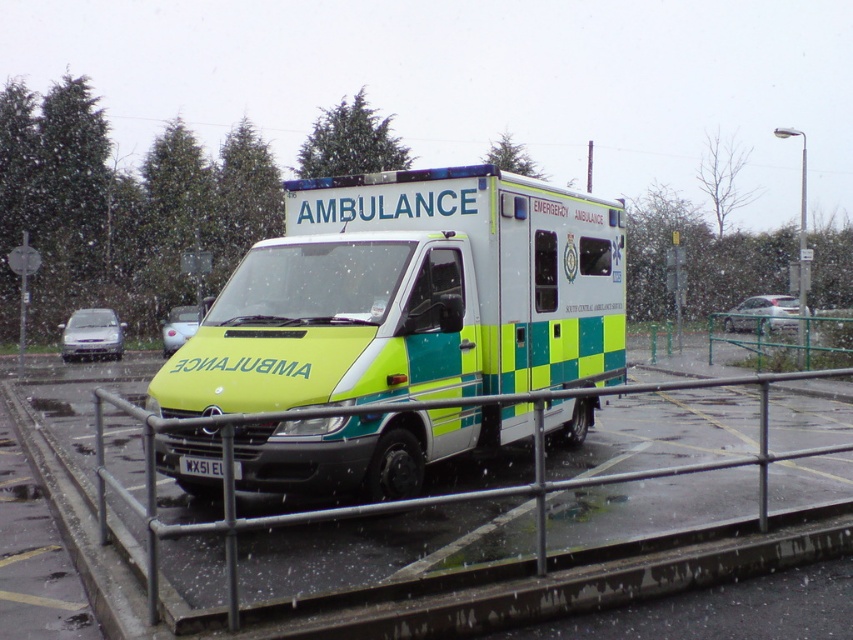
Between metal/textured rail at lower center and silver metallic sedan at center, which one is positioned higher?

Positioned higher is silver metallic sedan at center.

Does metal/textured rail at lower center appear on the left side of silver metallic sedan at center?

Yes, metal/textured rail at lower center is to the left of silver metallic sedan at center.

Find the location of a particular element. metal/textured rail at lower center is located at coordinates (428, 496).

Is yellow-green checkered ambulance at center to the right of metallic silver car at left from the viewer's perspective?

Yes, yellow-green checkered ambulance at center is to the right of metallic silver car at left.

Does yellow-green checkered ambulance at center come in front of metallic silver car at left?

Yes, it is in front of metallic silver car at left.

Which is behind, point (289, 212) or point (184, 337)?

The point (184, 337) is behind.

Locate an element on the screen. yellow-green checkered ambulance at center is located at coordinates (410, 296).

Does yellow-green checkered ambulance at center appear over silver metallic hatchback at lower left?

Correct, yellow-green checkered ambulance at center is located above silver metallic hatchback at lower left.

Is yellow-green checkered ambulance at center thinner than silver metallic hatchback at lower left?

Correct, yellow-green checkered ambulance at center's width is less than silver metallic hatchback at lower left's.

Does point (532, 307) come behind point (86, 314)?

No, (532, 307) is in front of (86, 314).

I want to click on yellow-green checkered ambulance at center, so click(x=410, y=296).